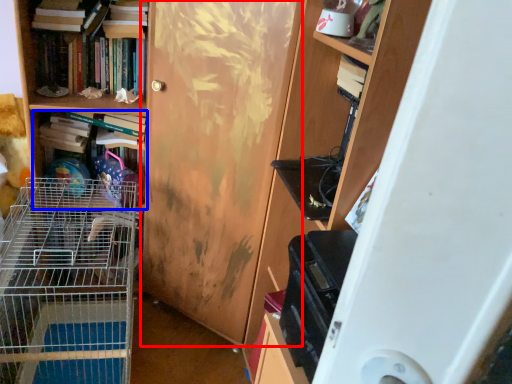
Question: Which point is further to the camera, door (highlighted by a red box) or book (highlighted by a blue box)?

Choices:
 (A) door
 (B) book

Answer: (B)